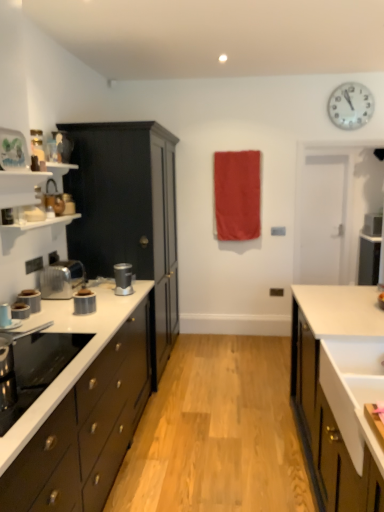
Where is `free space above red fabric at center (from a real-world perspective)`? This screenshot has width=384, height=512. free space above red fabric at center (from a real-world perspective) is located at coordinates (238, 150).